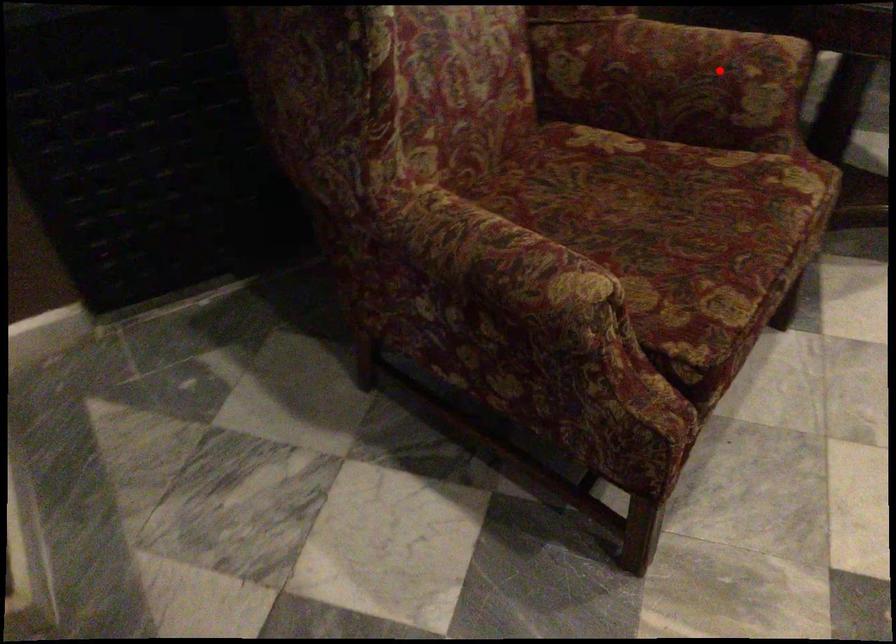
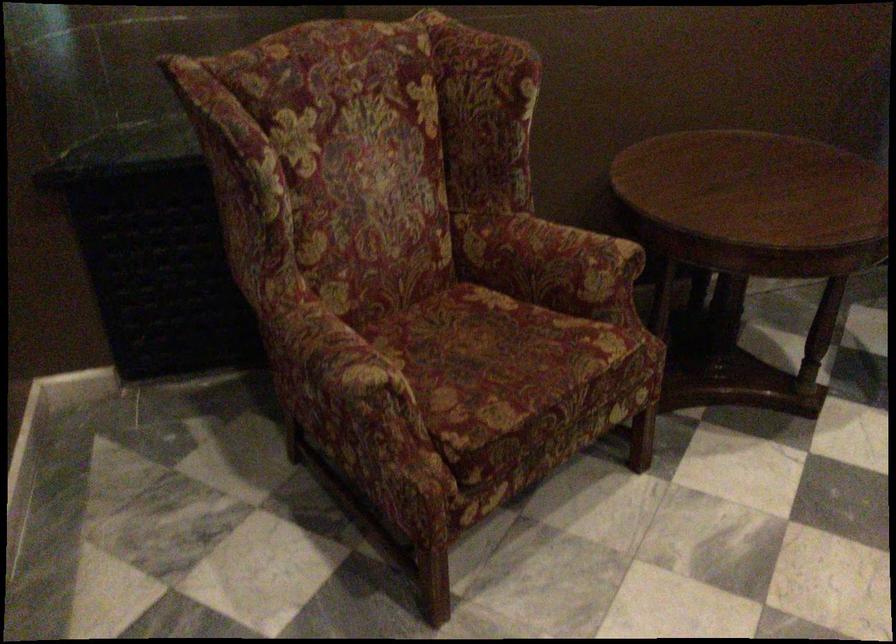
Question: A red point is marked in image1. In image2, is the corresponding 3D point closer to the camera or farther? Reply with the corresponding letter.

Choices:
 (A) The corresponding 3D point is closer.
 (B) The corresponding 3D point is farther.

Answer: (B)